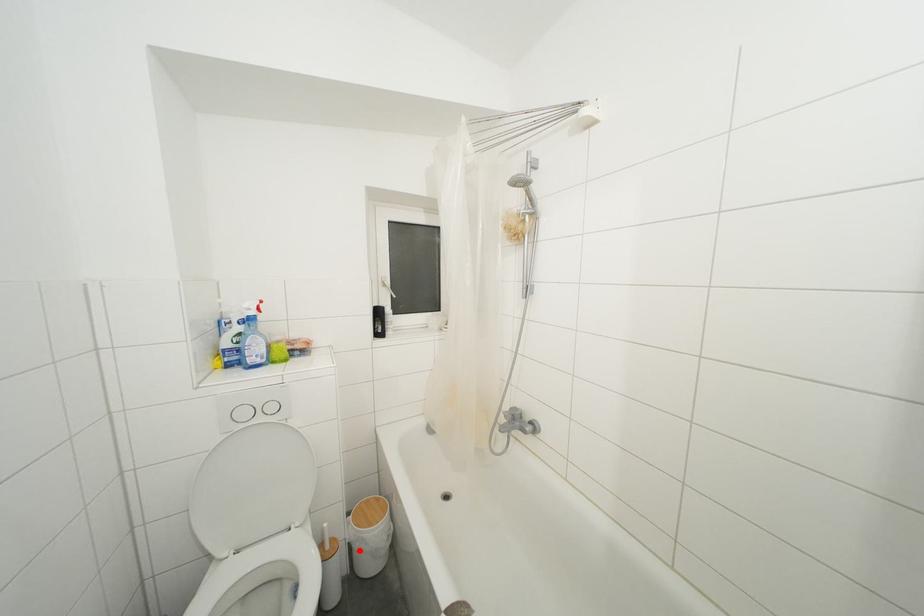
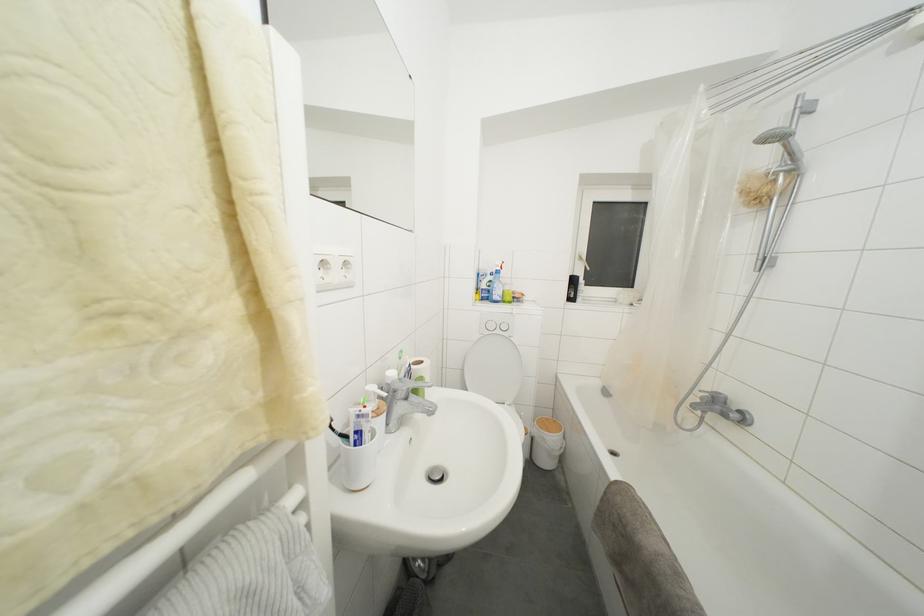
The point at the highlighted location is marked in the first image. Where is the corresponding point in the second image?

(541, 445)